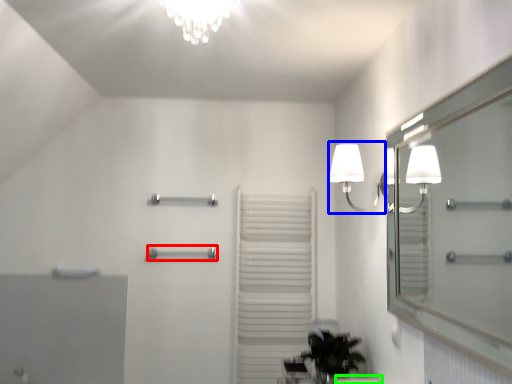
Question: Which object is positioned closest to towel bar (highlighted by a red box)? Select from lamp (highlighted by a blue box) and counter top (highlighted by a green box).

Choices:
 (A) lamp
 (B) counter top

Answer: (A)